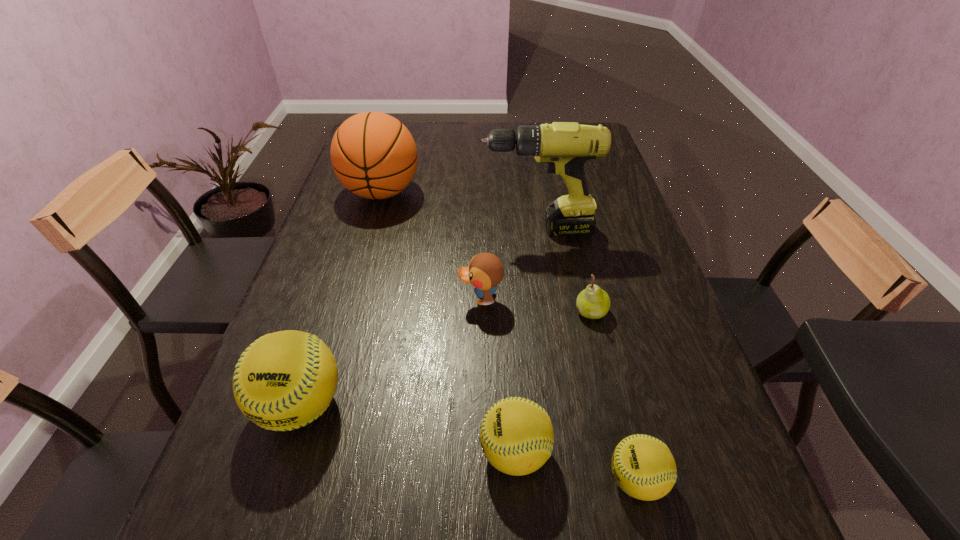
If equal spacing is the goal by inserting an additional softball among them, please point out a vacant space for this new softball. Please provide its 2D coordinates. Your answer should be formatted as a tuple, i.e. [(x, y)], where the tuple contains the x and y coordinates of a point satisfying the conditions above.

[(403, 427)]